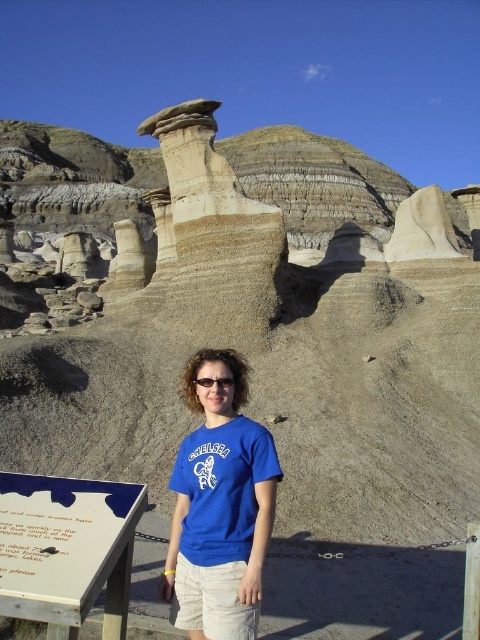
You are a hiker in the desert and want to read the white wood sign at lower left. You also have transparent plastic goggles at center. Which object is nearer to you?

The white wood sign at lower left is closer to the viewer than the transparent plastic goggles at center.

You are a hiker who just arrived at the desert location and see the white wood sign at lower left and the transparent plastic goggles at center. Which object is closer to the ground?

The white wood sign at lower left is closer to the ground because it is positioned below the transparent plastic goggles at center.